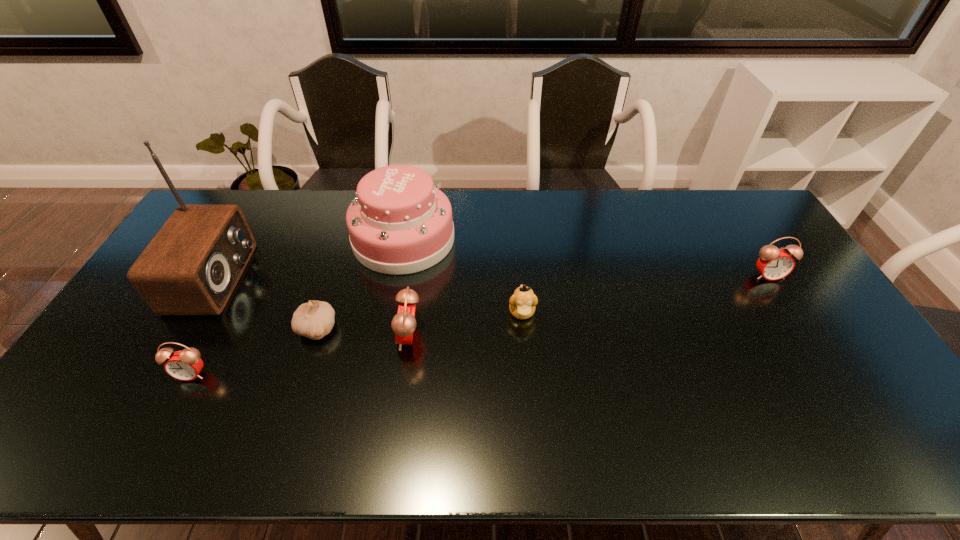
Where is `the nearest alarm clock`? The height and width of the screenshot is (540, 960). the nearest alarm clock is located at coordinates (185, 365).

Identify the location of the shortest alarm clock. The image size is (960, 540). (185, 365).

Where is `the second alarm clock from right to left`? Image resolution: width=960 pixels, height=540 pixels. the second alarm clock from right to left is located at coordinates (403, 324).

Where is `the rightmost object`? The height and width of the screenshot is (540, 960). the rightmost object is located at coordinates (774, 264).

At what (x,y) coordinates should I click in order to perform the action: click on the fourth tallest object. Please return your answer as a coordinate pair (x, y). The image size is (960, 540). Looking at the image, I should click on (774, 264).

Image resolution: width=960 pixels, height=540 pixels. Identify the location of cake. (400, 223).

At what (x,y) coordinates should I click in order to perform the action: click on the tallest object. Please return your answer as a coordinate pair (x, y). The width and height of the screenshot is (960, 540). Looking at the image, I should click on (192, 265).

The height and width of the screenshot is (540, 960). I want to click on garlic, so click(x=315, y=319).

Locate an element on the screen. The image size is (960, 540). the second object from right to left is located at coordinates point(522,303).

Locate an element on the screen. This screenshot has height=540, width=960. vacant area situated 0.080m on the clock face of the leftmost alarm clock is located at coordinates (173, 411).